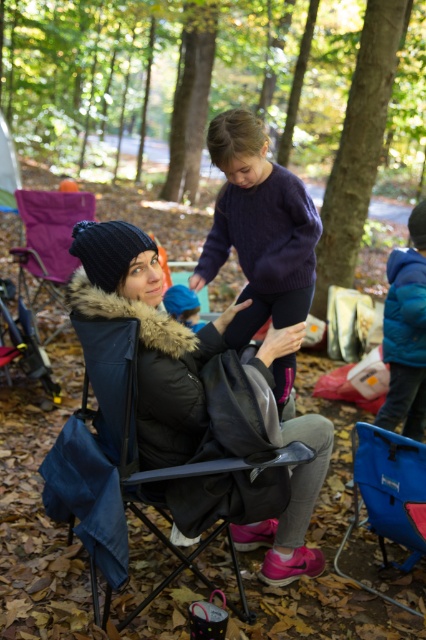
Is black fuzzy jacket at center below matte black chair at left?

Yes.

Consider the image. Is black fuzzy jacket at center closer to the viewer compared to matte black chair at left?

Yes, black fuzzy jacket at center is in front of matte black chair at left.

Identify the location of black fuzzy jacket at center. (149, 337).

Identify the location of black fuzzy jacket at center. (149, 337).

Is the position of black fuzzy jacket at center more distant than that of purple knitted sweater at upper center?

No, black fuzzy jacket at center is in front of purple knitted sweater at upper center.

Is black fuzzy jacket at center below purple knitted sweater at upper center?

Correct, black fuzzy jacket at center is located below purple knitted sweater at upper center.

Find the location of a particular element. This screenshot has height=640, width=426. black fuzzy jacket at center is located at coordinates (149, 337).

This screenshot has height=640, width=426. I want to click on black fuzzy jacket at center, so click(149, 337).

Between point (118, 305) and point (417, 472), which one is positioned behind?

Positioned behind is point (417, 472).

The image size is (426, 640). What do you see at coordinates (149, 337) in the screenshot? I see `black fuzzy jacket at center` at bounding box center [149, 337].

This screenshot has height=640, width=426. I want to click on black fuzzy jacket at center, so click(149, 337).